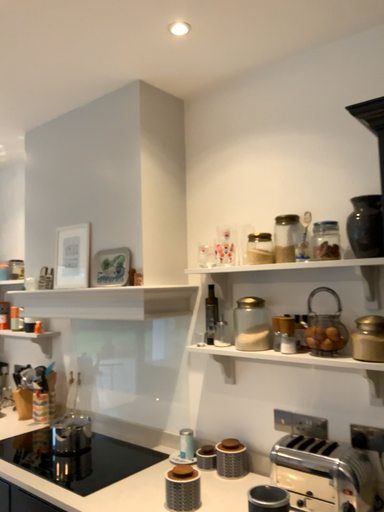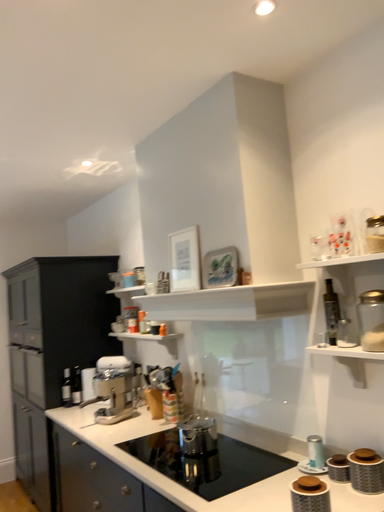
Question: How did the camera likely rotate when shooting the video?

Choices:
 (A) rotated left
 (B) rotated right

Answer: (A)